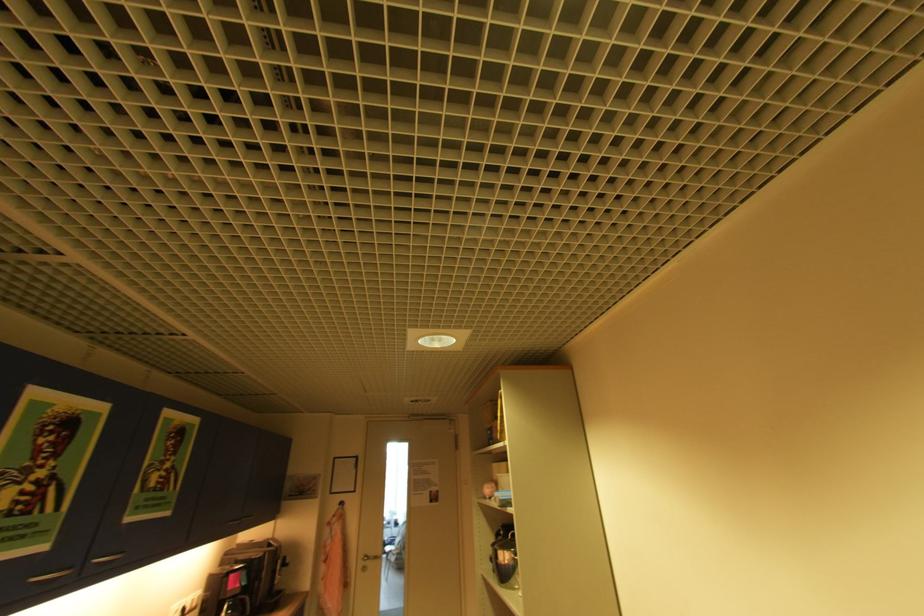
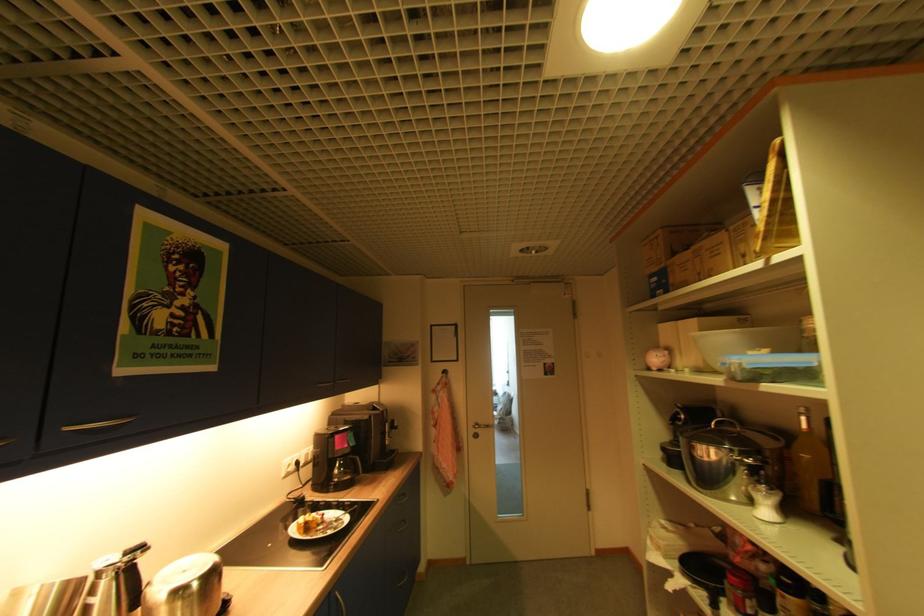
The point at (237, 576) is marked in the first image. Where is the corresponding point in the second image?

(343, 437)